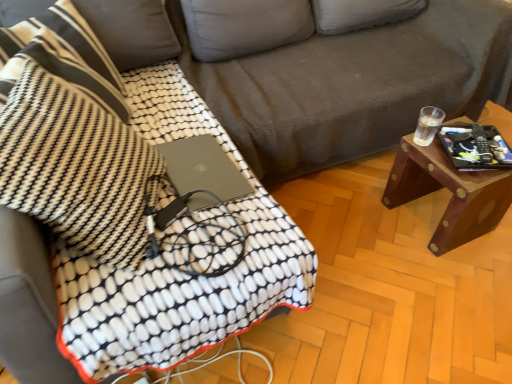
Question: From the image's perspective, would you say black matte tablet at right is positioned over gray corduroy couch at center?

Choices:
 (A) yes
 (B) no

Answer: (B)

Question: Is black matte tablet at right with gray corduroy couch at center?

Choices:
 (A) yes
 (B) no

Answer: (B)

Question: From a real-world perspective, does black matte tablet at right stand above gray corduroy couch at center?

Choices:
 (A) no
 (B) yes

Answer: (A)

Question: Can you confirm if black matte tablet at right is thinner than gray corduroy couch at center?

Choices:
 (A) no
 (B) yes

Answer: (B)

Question: From a real-world perspective, is black matte tablet at right physically below gray corduroy couch at center?

Choices:
 (A) yes
 (B) no

Answer: (A)

Question: Is black matte tablet at right turned away from gray corduroy couch at center?

Choices:
 (A) no
 (B) yes

Answer: (B)

Question: From a real-world perspective, does gray corduroy couch at center stand above black textured throw pillow at upper left, which ranks as the 2th throw pillow in front-to-back order?

Choices:
 (A) no
 (B) yes

Answer: (A)

Question: From the image's perspective, is gray corduroy couch at center below black textured throw pillow at upper left, which ranks as the 2th throw pillow in front-to-back order?

Choices:
 (A) yes
 (B) no

Answer: (B)

Question: Considering the relative sizes of gray corduroy couch at center and black textured throw pillow at upper left, which is the first throw pillow from back to front, in the image provided, is gray corduroy couch at center taller than black textured throw pillow at upper left, which is the first throw pillow from back to front,?

Choices:
 (A) yes
 (B) no

Answer: (A)

Question: Is gray corduroy couch at center positioned with its back to black textured throw pillow at upper left, which is the first throw pillow from back to front?

Choices:
 (A) no
 (B) yes

Answer: (A)

Question: Does gray corduroy couch at center have a larger size compared to black textured throw pillow at upper left, which ranks as the 2th throw pillow in front-to-back order?

Choices:
 (A) yes
 (B) no

Answer: (A)

Question: Is gray corduroy couch at center further to the viewer compared to black textured throw pillow at upper left, which ranks as the 2th throw pillow in front-to-back order?

Choices:
 (A) no
 (B) yes

Answer: (B)

Question: Is black textured throw pillow at left, the 2th throw pillow from the back, positioned far away from black textured throw pillow at upper left, which ranks as the 2th throw pillow in front-to-back order?

Choices:
 (A) yes
 (B) no

Answer: (B)